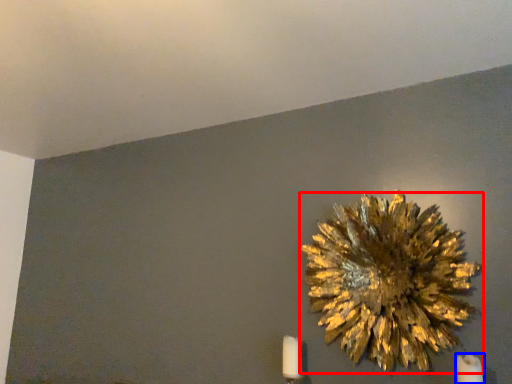
Question: Among these objects, which one is nearest to the camera, flower (highlighted by a red box) or candle (highlighted by a blue box)?

Choices:
 (A) flower
 (B) candle

Answer: (B)